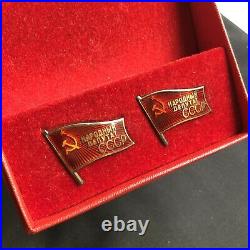
The image size is (250, 250). I want to click on corner, so click(36, 228).